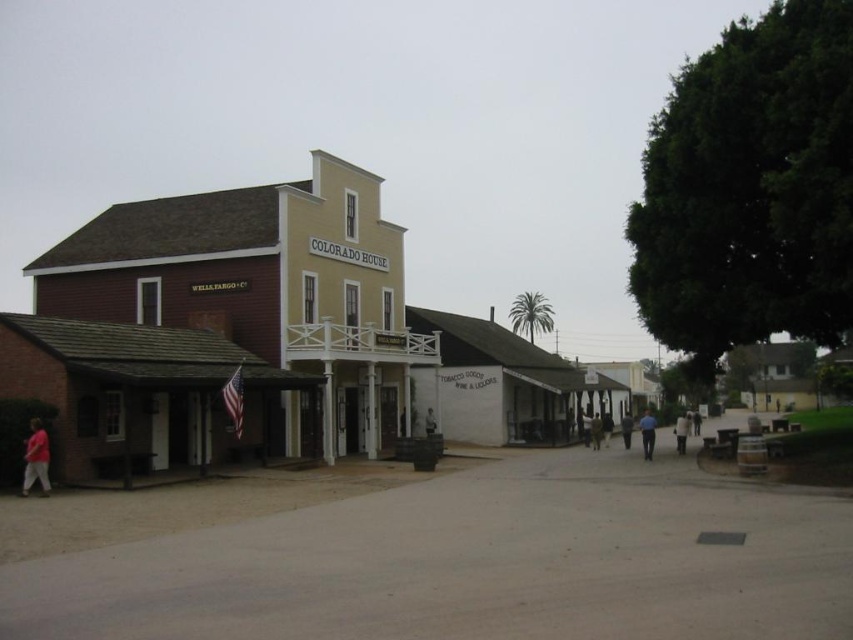
Question: Which object is farther from the camera taking this photo?

Choices:
 (A) pink fabric shirt at lower left
 (B) light brown leather jacket at center
 (C) blue uniform at center

Answer: (B)

Question: Which point appears farthest from the camera in this image?

Choices:
 (A) (676, 449)
 (B) (45, 454)
 (C) (648, 416)

Answer: (C)

Question: Is blue uniform at center smaller than light brown leather jacket at center?

Choices:
 (A) no
 (B) yes

Answer: (B)

Question: Does pink fabric shirt at lower left lie behind blue uniform at center?

Choices:
 (A) no
 (B) yes

Answer: (A)

Question: From the image, what is the correct spatial relationship of pink fabric shirt at lower left in relation to light brown leather jacket at center?

Choices:
 (A) above
 (B) below

Answer: (A)

Question: Which of the following is the closest to the observer?

Choices:
 (A) (683, 422)
 (B) (645, 435)

Answer: (B)